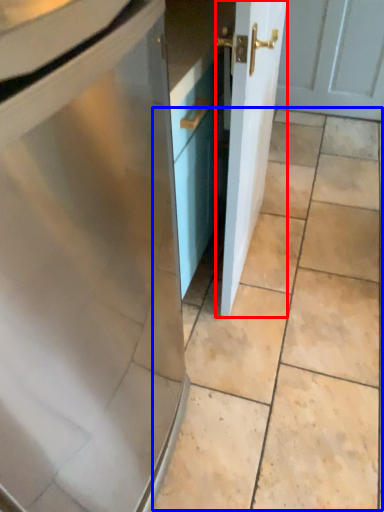
Question: Which point is closer to the camera, door (highlighted by a red box) or ceramic tile (highlighted by a blue box)?

Choices:
 (A) door
 (B) ceramic tile

Answer: (A)